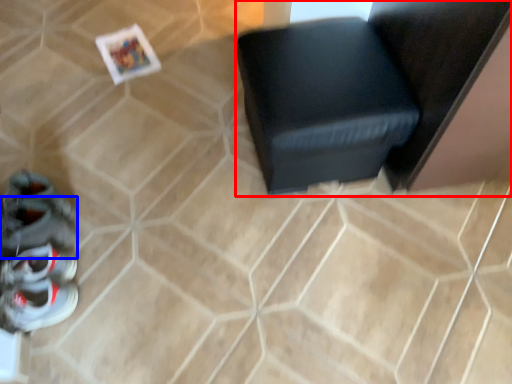
Question: Among these objects, which one is nearest to the camera, furniture (highlighted by a red box) or shoe (highlighted by a blue box)?

Choices:
 (A) furniture
 (B) shoe

Answer: (A)